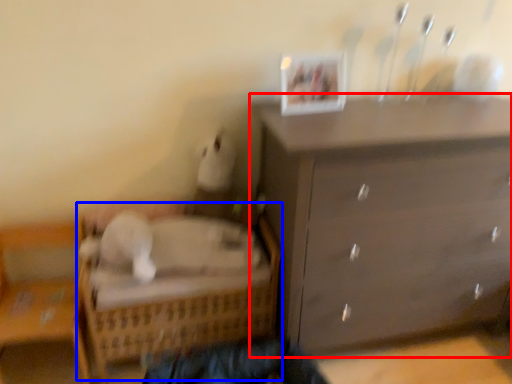
Question: Which point is further to the camera, chest of drawers (highlighted by a red box) or bed (highlighted by a blue box)?

Choices:
 (A) chest of drawers
 (B) bed

Answer: (B)